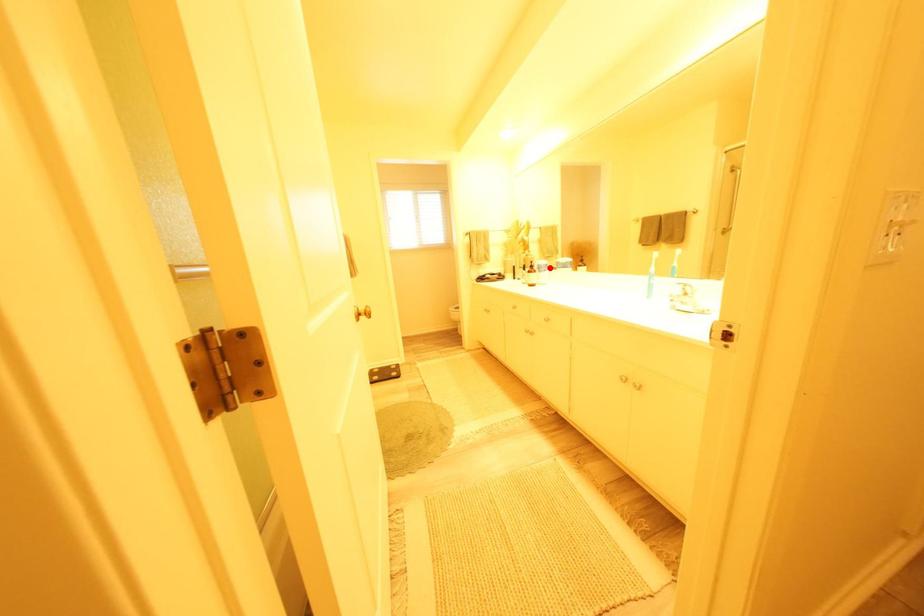
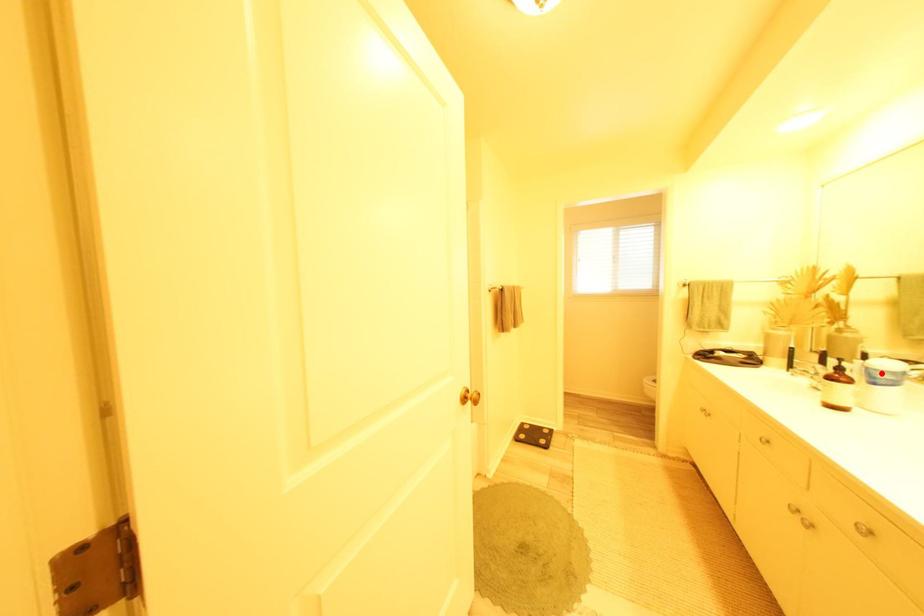
I am providing you with two images of the same scene from different viewpoints. A red point is marked on the first image and another point is marked on the second image. Does the point marked in image1 correspond to the same location as the one in image2?

Yes